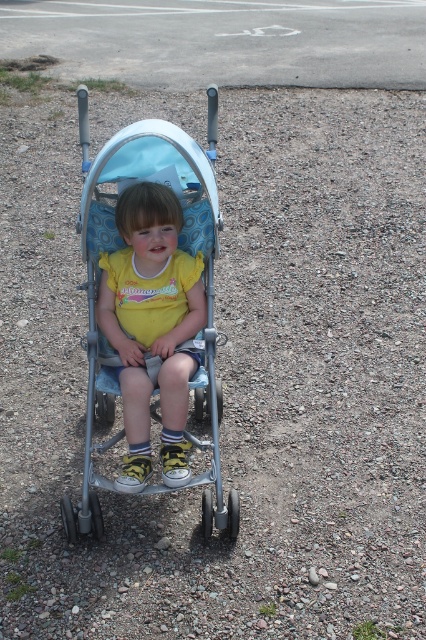
Question: In this image, where is metallic silver stroller at center located relative to yellow matte shirt at center?

Choices:
 (A) left
 (B) right

Answer: (A)

Question: Among these objects, which one is nearest to the camera?

Choices:
 (A) yellow matte shirt at center
 (B) metallic silver stroller at center

Answer: (B)

Question: Among these points, which one is nearest to the camera?

Choices:
 (A) (172, 125)
 (B) (154, 220)

Answer: (B)

Question: Does metallic silver stroller at center have a lesser width compared to yellow matte shirt at center?

Choices:
 (A) yes
 (B) no

Answer: (B)

Question: Which of the following is the closest to the observer?

Choices:
 (A) (112, 268)
 (B) (112, 442)

Answer: (B)

Question: Where is metallic silver stroller at center located in relation to yellow matte shirt at center in the image?

Choices:
 (A) below
 (B) above

Answer: (B)